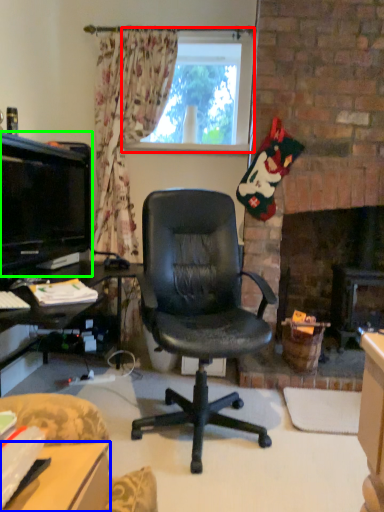
Question: Based on their relative distances, which object is nearer to window (highlighted by a red box)? Choose from desk (highlighted by a blue box) and television (highlighted by a green box).

Choices:
 (A) desk
 (B) television

Answer: (B)